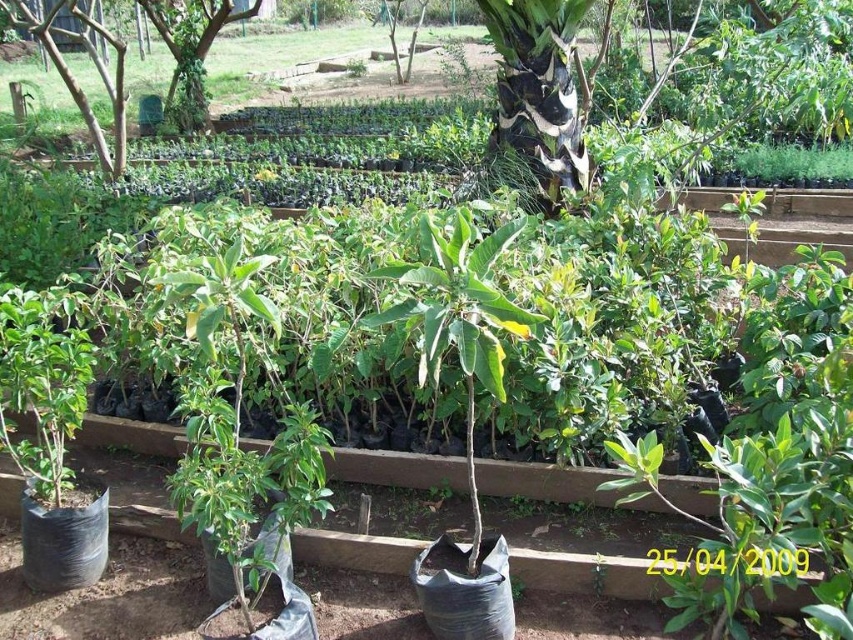
You are a gardener standing in the nursery and want to water the green leafy tree at upper left and the green plastic tree at upper left. Which one should you water first if you want to water the closer one first?

The green leafy tree at upper left is closer to the viewer than the green plastic tree at upper left, so you should water the green leafy tree at upper left first.

You are a gardener who needs to water the plants. You see the black and white bark at center and the green plastic tree at upper left. Which one is closer to you?

The black and white bark at center is closer to you because it is in front of the green plastic tree at upper left.

You are a gardener standing in the nursery. You need to reach both the point at coordinates point (599, 60) and point (181, 99). Which point is closer to you?

Point (599, 60) is in front of point (181, 99), so it is closer to you.